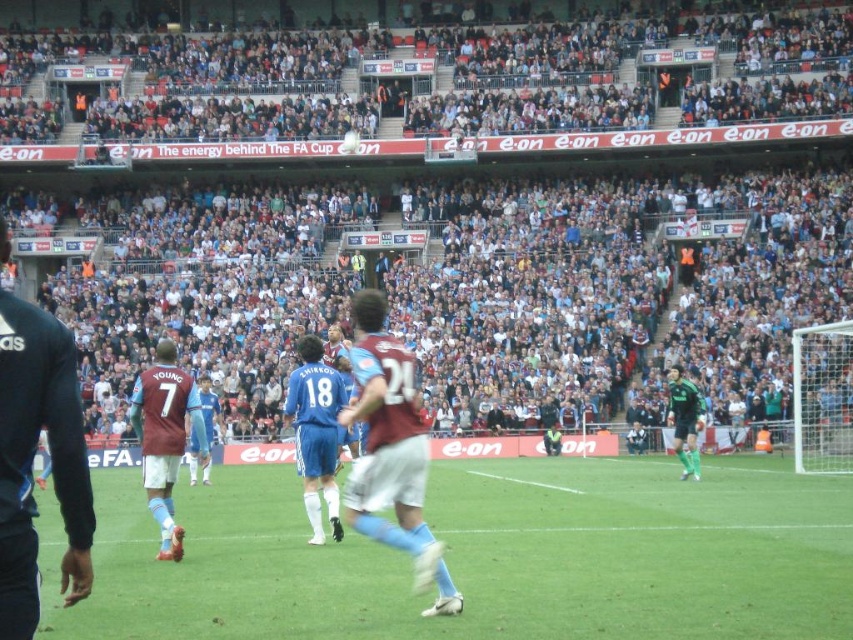
You are a photographer at the stadium and want to capture a photo of the black synthetic jacket at left and the matte blue shorts at center. Which object should you zoom in on to ensure they both fit in the frame?

The black synthetic jacket at left is smaller in size compared to the matte blue shorts at center. To ensure both fit in the frame, you should zoom in on the larger object, which is the matte blue shorts at center.

You are a photographer at the stadium and want to capture a photo where both the black synthetic jacket at left and the matte blue shorts at center are visible. Based on their heights, which object should you focus on to ensure both are in frame?

The black synthetic jacket at left is shorter than the matte blue shorts at center, so focusing on the matte blue shorts at center will ensure both are visible since it is taller and can be framed alongside the shorter jacket.

You are a photographer at the FA Cup match. You want to take a photo of both the green grass at center and the green matte jersey at right. Based on their positions, which object is closer to the left side of the photo?

The green grass at center is closer to the left side of the photo because it is positioned to the left of the green matte jersey at right.